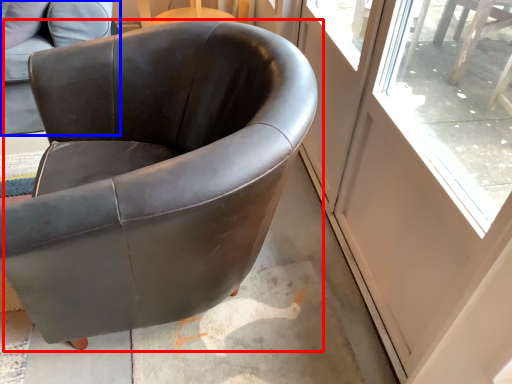
Question: Which object appears farthest to the camera in this image, chair (highlighted by a red box) or chair (highlighted by a blue box)?

Choices:
 (A) chair
 (B) chair

Answer: (B)